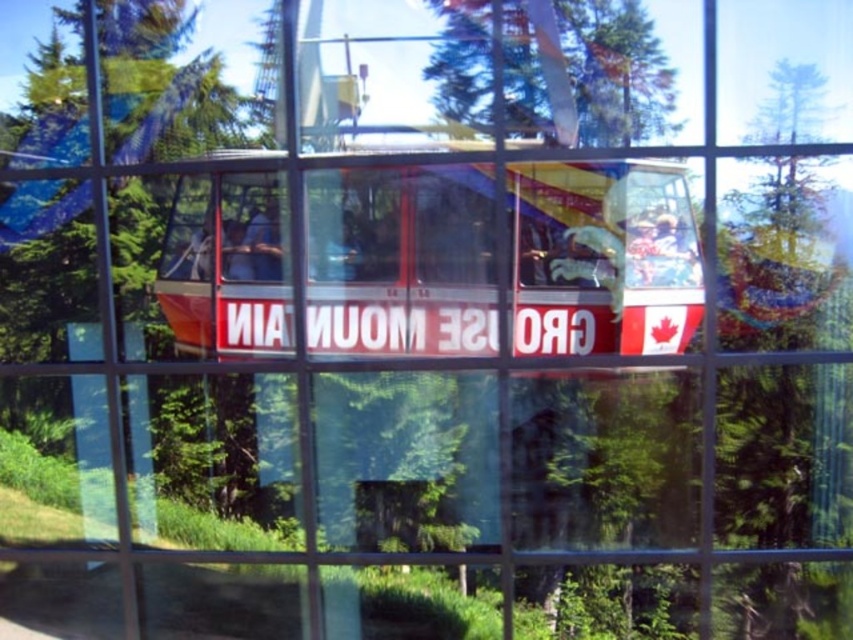
In the scene shown: You are standing in front of the window shown in the image. You see the translucent glass decker bus at center and the green leafy tree at upper center. Which object is closer to the top of the window?

The green leafy tree at upper center is closer to the top of the window since it is positioned above the translucent glass decker bus at center.

You are standing in front of a window with a grid pattern and see the translucent glass decker bus at center and the green leafy tree at upper center reflected in the glass. Which object appears closer to the left side of the window?

The translucent glass decker bus at center is positioned on the left side of green leafy tree at upper center, so it appears closer to the left side of the window.

You are standing at the camera position and want to take a photo of the translucent glass decker bus at center. Can you fit the entire bus in your camera frame without moving? The camera has a standard 50mm lens and the bus is 20 feet long.

The translucent glass decker bus at center is 7.00 feet away from the camera. With a standard 50mm lens, the maximum field of view at that distance is approximately 8 feet wide. Since the bus is 20 feet long, it is longer than the camera frame can capture without moving. Therefore, you cannot fit the entire bus in the frame without moving.